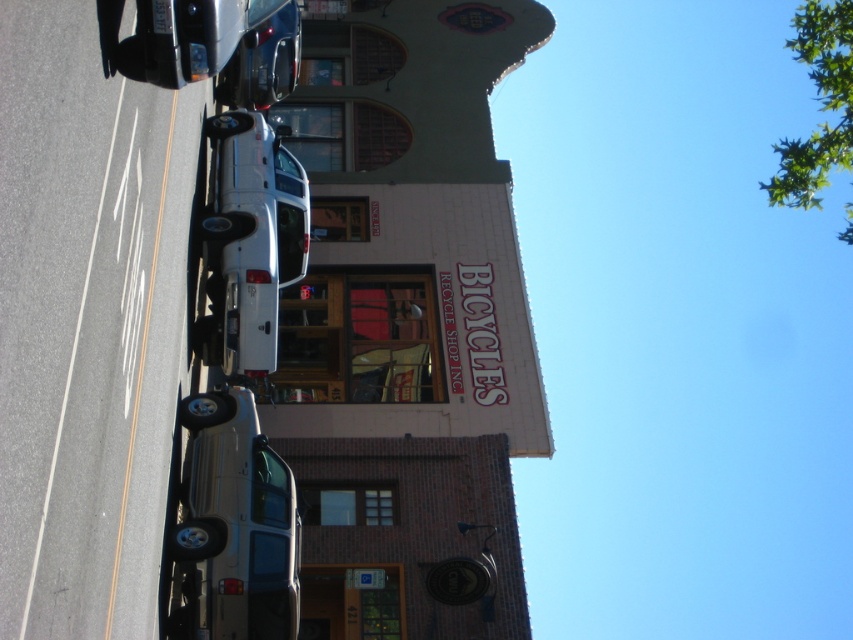
Question: Can you confirm if white matte truck at center is positioned below metallic silver car at upper center?

Choices:
 (A) yes
 (B) no

Answer: (A)

Question: Which point appears closest to the camera in this image?

Choices:
 (A) (181, 499)
 (B) (260, 104)
 (C) (257, 214)

Answer: (A)

Question: Which point is farther from the camera taking this photo?

Choices:
 (A) (245, 538)
 (B) (285, 10)

Answer: (B)

Question: Can you confirm if white matte truck at center is positioned to the right of metallic silver car at upper center?

Choices:
 (A) yes
 (B) no

Answer: (B)

Question: Which object is positioned closest to the satin silver suv at lower left?

Choices:
 (A) metallic silver car at upper center
 (B) white matte truck at center

Answer: (B)

Question: Does white matte truck at center appear under metallic silver car at upper center?

Choices:
 (A) no
 (B) yes

Answer: (B)